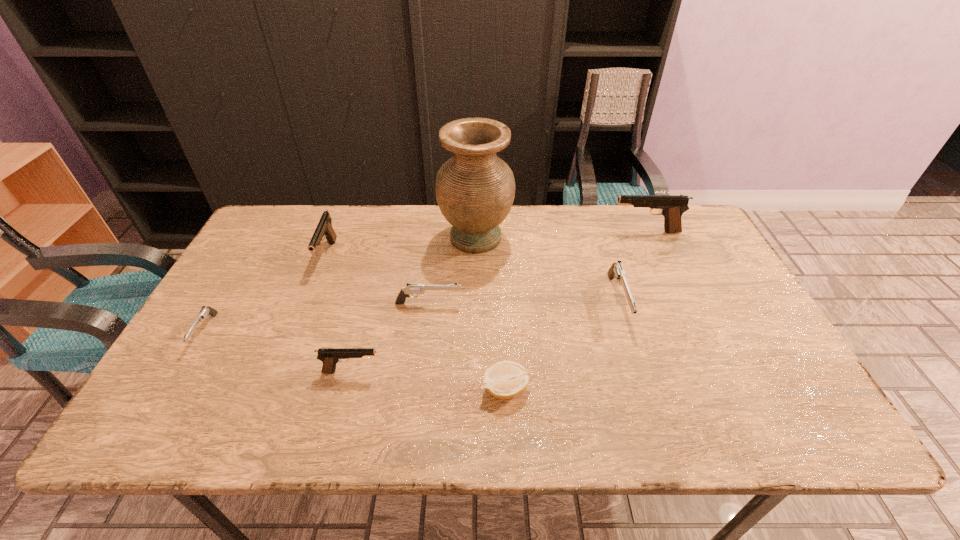
Locate an element on the screen. empty space between the seventh object from left to right and the leftmost pistol is located at coordinates (412, 316).

Identify the location of unoccupied area between the rightmost pistol and the seventh object from left to right. (632, 266).

Identify the location of free space between the second pistol from right to left and the fifth pistol from right to left. (472, 278).

Find the location of `vacant region between the nearest pistol and the tallest object`. vacant region between the nearest pistol and the tallest object is located at coordinates (414, 305).

The height and width of the screenshot is (540, 960). I want to click on vacant region between the green vase and the smallest black pistol, so click(x=414, y=305).

Where is `free space between the rightmost object and the fourth pistol from left to right`? The image size is (960, 540). free space between the rightmost object and the fourth pistol from left to right is located at coordinates (538, 268).

Image resolution: width=960 pixels, height=540 pixels. I want to click on the third closest object relative to the leftmost silver pistol, so click(412, 289).

You are a GUI agent. You are given a task and a screenshot of the screen. Output one action in this format:
    pyautogui.click(x=<x>, y=<y>)
    Task: Click on the object that stands as the seventh closest to the green vase
    Image resolution: width=960 pixels, height=540 pixels.
    Given the screenshot: What is the action you would take?
    pyautogui.click(x=205, y=311)

I want to click on pistol that stands as the fourth closest to the farthest black pistol, so click(324, 228).

Locate an element on the screen. pistol that stands as the fourth closest to the rightmost pistol is located at coordinates (324, 228).